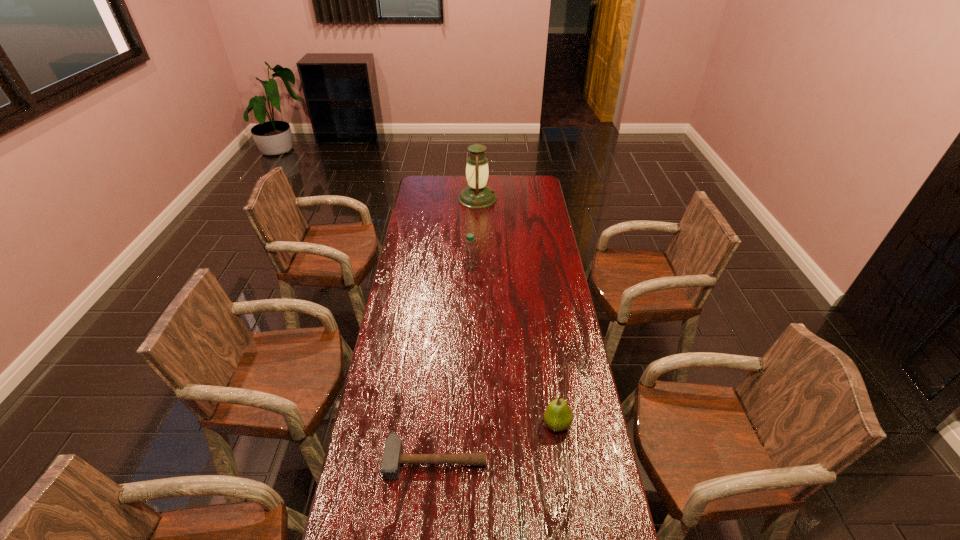
Where is `the farthest object`? This screenshot has height=540, width=960. the farthest object is located at coordinates coord(477,195).

The height and width of the screenshot is (540, 960). In order to click on lantern in this screenshot , I will do `click(477, 195)`.

Where is `the second tallest object`? the second tallest object is located at coordinates (470, 252).

Find the location of a particular element. The height and width of the screenshot is (540, 960). the third nearest object is located at coordinates (470, 252).

Find the location of a particular element. This screenshot has height=540, width=960. pear is located at coordinates (558, 416).

Find the location of `the rightmost object`. the rightmost object is located at coordinates (558, 416).

At what (x,y) coordinates should I click in order to perform the action: click on the nearest object. Please return your answer as a coordinate pair (x, y). The height and width of the screenshot is (540, 960). Looking at the image, I should click on (393, 457).

Where is `hammer`? Image resolution: width=960 pixels, height=540 pixels. hammer is located at coordinates pos(393,457).

Identify the location of vacant space located 0.070m with the light compartment facing forward on the tallest object. This screenshot has height=540, width=960. (510, 199).

Find the location of a particular element. The height and width of the screenshot is (540, 960). vacant space situated 0.180m on the front of the water bottle is located at coordinates (469, 300).